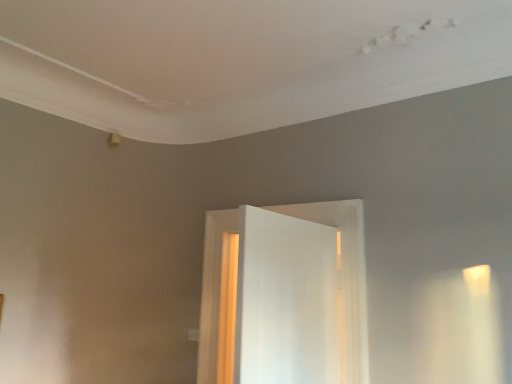
I want to click on white matte door at center, so click(345, 267).

What do you see at coordinates (345, 267) in the screenshot?
I see `white matte door at center` at bounding box center [345, 267].

Measure the distance between white matte door at center and camera.

2.29 meters.

The height and width of the screenshot is (384, 512). Identify the location of white matte door at center. (345, 267).